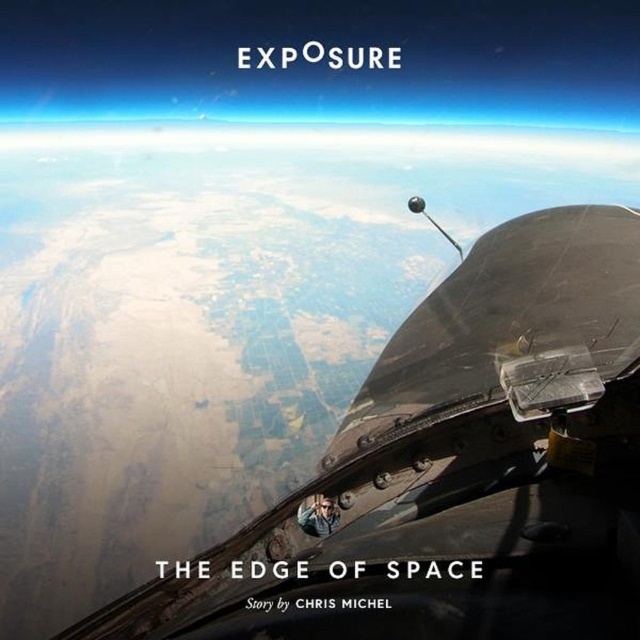
Question: Which point is farther to the camera?

Choices:
 (A) matte black helmet at center
 (B) shiny metallic cockpit at center

Answer: (A)

Question: Does shiny metallic cockpit at center appear on the left side of matte black helmet at center?

Choices:
 (A) no
 (B) yes

Answer: (A)

Question: From the image, what is the correct spatial relationship of shiny metallic cockpit at center in relation to matte black helmet at center?

Choices:
 (A) below
 (B) above

Answer: (B)

Question: Is shiny metallic cockpit at center in front of matte black helmet at center?

Choices:
 (A) no
 (B) yes

Answer: (B)

Question: Which object is farther from the camera taking this photo?

Choices:
 (A) shiny metallic cockpit at center
 (B) matte black helmet at center

Answer: (B)